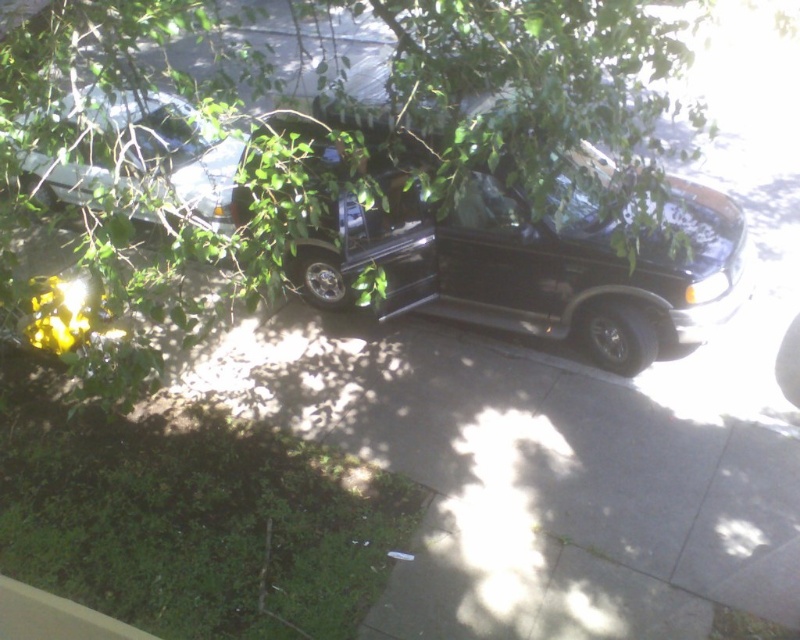
Question: Is metallic silver car at upper left to the left of gray concrete curb at lower left from the viewer's perspective?

Choices:
 (A) yes
 (B) no

Answer: (A)

Question: Is metallic silver car at upper left bigger than gray concrete curb at lower left?

Choices:
 (A) yes
 (B) no

Answer: (A)

Question: Which point appears farthest from the camera in this image?

Choices:
 (A) (28, 592)
 (B) (142, 109)

Answer: (B)

Question: Which object appears closest to the camera in this image?

Choices:
 (A) gray concrete curb at lower left
 (B) metallic silver car at upper left

Answer: (A)

Question: Among these objects, which one is farthest from the camera?

Choices:
 (A) metallic silver car at upper left
 (B) gray concrete curb at lower left

Answer: (A)

Question: Is metallic silver car at upper left smaller than gray concrete curb at lower left?

Choices:
 (A) no
 (B) yes

Answer: (A)